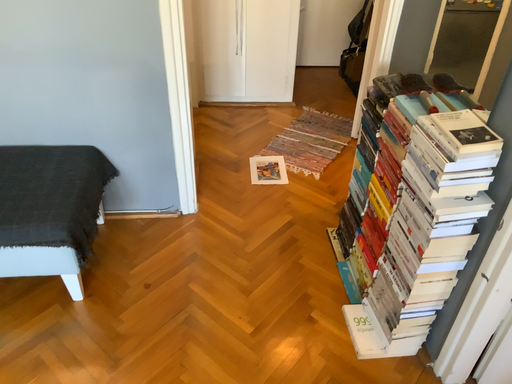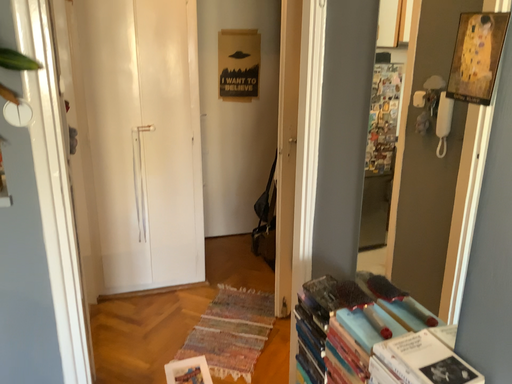
Question: Which way did the camera rotate in the video?

Choices:
 (A) rotated right
 (B) rotated left

Answer: (A)